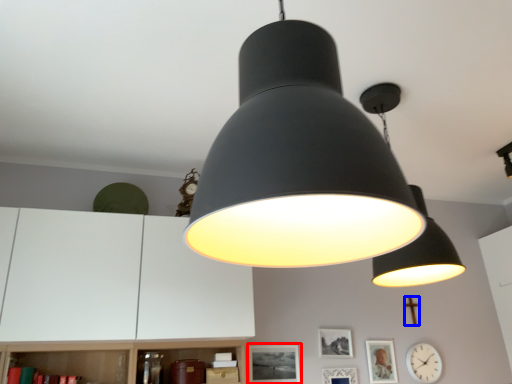
Question: Which object is further to the camera taking this photo, picture frame (highlighted by a red box) or crucifix (highlighted by a blue box)?

Choices:
 (A) picture frame
 (B) crucifix

Answer: (B)